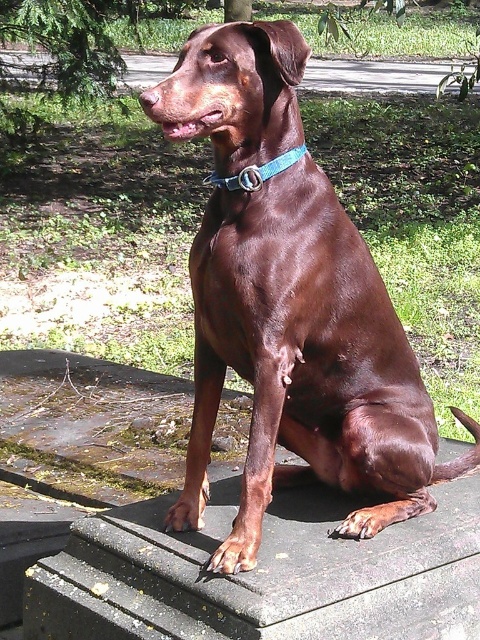
You are a photographer aiming to capture the shiny brown dog at center. If you want to position the dog exactly at the center of the frame, which is at point 0.5, 0.5, how should you adjust your camera? Please state the direction and distance needed for the adjustment.

The shiny brown dog at center is currently at point (304,362). To center it at (240,320), move the camera 0.067 units to the left and 0.135 units downward.

You are a dog trainer trying to assess the space between the shiny brown dog at center and the smooth concrete ledge at center. Based on the scene described, can the dog comfortably turn around in the space between them?

The shiny brown dog at center is 34.46 centimeters from the smooth concrete ledge at center. Since this distance is likely insufficient for a dog of typical size to turn around comfortably, the dog would not have enough space to maneuver between them.

You are a photographer standing in front of the Doberman Pinscher on the concrete steps. You want to take a photo that includes both points mentioned. Which point is closer to you, point (377, 557) or point (253, 182)?

Point (253, 182) is closer to you because the description states that point (377, 557) is further away from the viewer compared to point (253, 182).